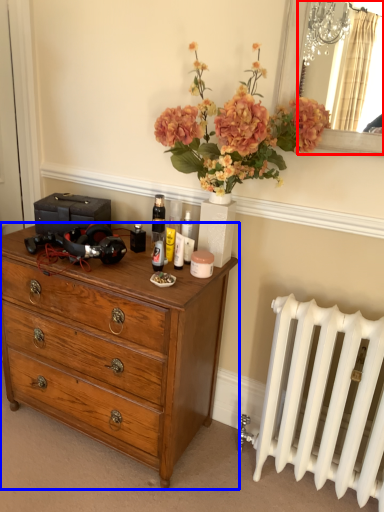
Question: Which object is closer to the camera taking this photo, mirror (highlighted by a red box) or chest of drawers (highlighted by a blue box)?

Choices:
 (A) mirror
 (B) chest of drawers

Answer: (A)